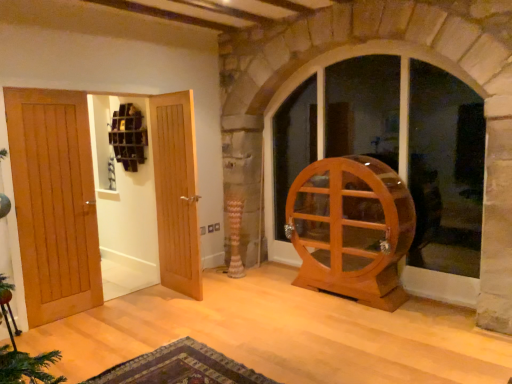
Locate an element on the screen. This screenshot has width=512, height=384. free space between light brown wood door at left, the 3th door in the right-to-left sequence, and light brown wood door at center, which ranks as the third door in left-to-right order is located at coordinates (125, 309).